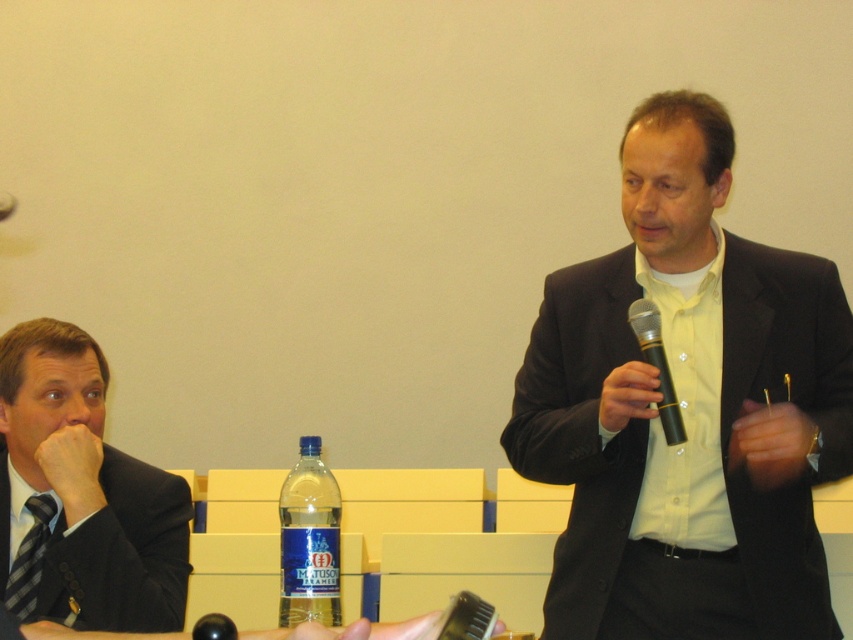
You are a photographer standing at the camera position. You want to adjust the focus so that both the matte black suit at right and the camera are in focus. What is the minimum distance you should set the focus to ensure both are sharp?

The minimum focus distance should be set to 1.82 meters to ensure both the matte black suit at right and the camera are in focus.

You are organizing a conference and need to ensure that the black textured suit at left and the black matte microphone at center can fit side by side on a 1.2 meter wide table. Given their widths, will they fit without overlapping?

The black textured suit at left is wider than the black matte microphone at center. However, without knowing their exact widths, it is impossible to determine if they will fit on a 1.2 meter wide table. Please provide more specific measurements for an accurate assessment.

You are an event planner trying to set up a new chair between the two points labeled as point [177,572] and point [666,404] in the scene. Based on their positions, which point should the chair be placed closer to so it doesn t block the speaker s view?

The chair should be placed closer to point [666,404] because point [177,572] is behind it, so placing the chair near the front point would avoid blocking the speaker s view.